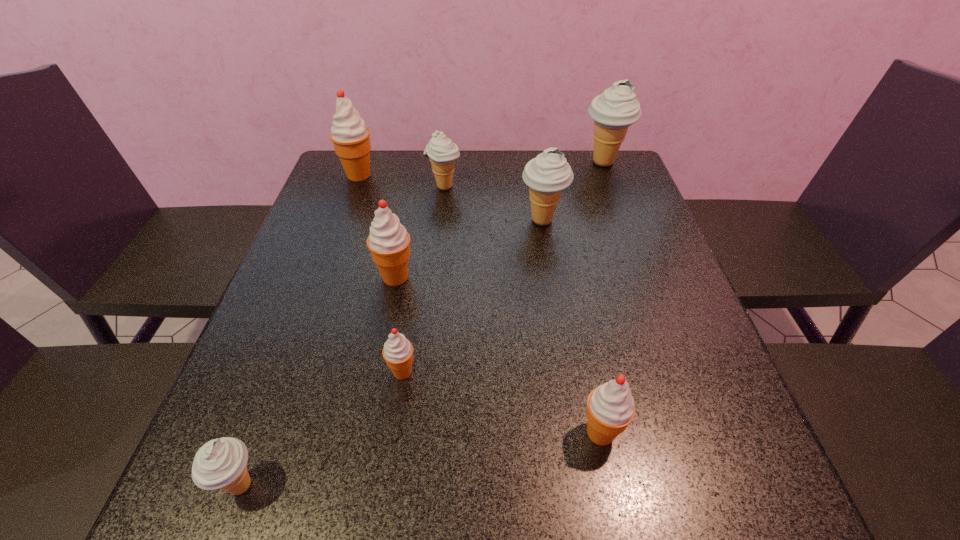
The width and height of the screenshot is (960, 540). What are the coordinates of `the rightmost beige icecream` in the screenshot? It's located at (613, 111).

You are a GUI agent. You are given a task and a screenshot of the screen. Output one action in this format:
    pyautogui.click(x=<x>, y=<y>)
    Task: Click on the biggest beige icecream
    Image resolution: width=960 pixels, height=540 pixels.
    Given the screenshot: What is the action you would take?
    pyautogui.click(x=613, y=111)

This screenshot has width=960, height=540. I want to click on the leftmost red icecream, so (350, 136).

Where is `the farthest red icecream`? The width and height of the screenshot is (960, 540). the farthest red icecream is located at coordinates (350, 136).

I want to click on the fifth nearest object, so click(549, 173).

This screenshot has height=540, width=960. In order to click on the second biggest beige icecream in this screenshot , I will do `click(549, 173)`.

Where is `the second biggest red icecream`? the second biggest red icecream is located at coordinates (388, 241).

What are the coordinates of `the third nearest red icecream` in the screenshot? It's located at (388, 241).

The height and width of the screenshot is (540, 960). I want to click on the second smallest beige icecream, so click(x=442, y=152).

Find the location of a particular element. the third beige icecream from right to left is located at coordinates (442, 152).